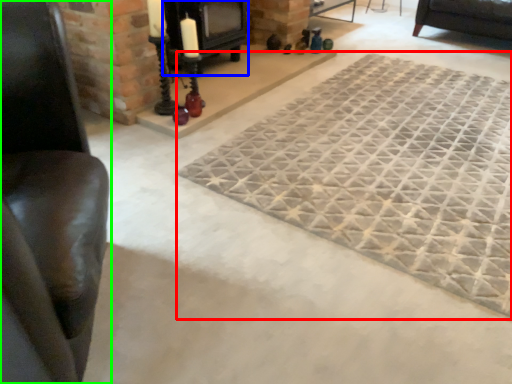
Question: Based on their relative distances, which object is nearer to mat (highlighted by a red box)? Choose from fireplace (highlighted by a blue box) and furniture (highlighted by a green box).

Choices:
 (A) fireplace
 (B) furniture

Answer: (A)